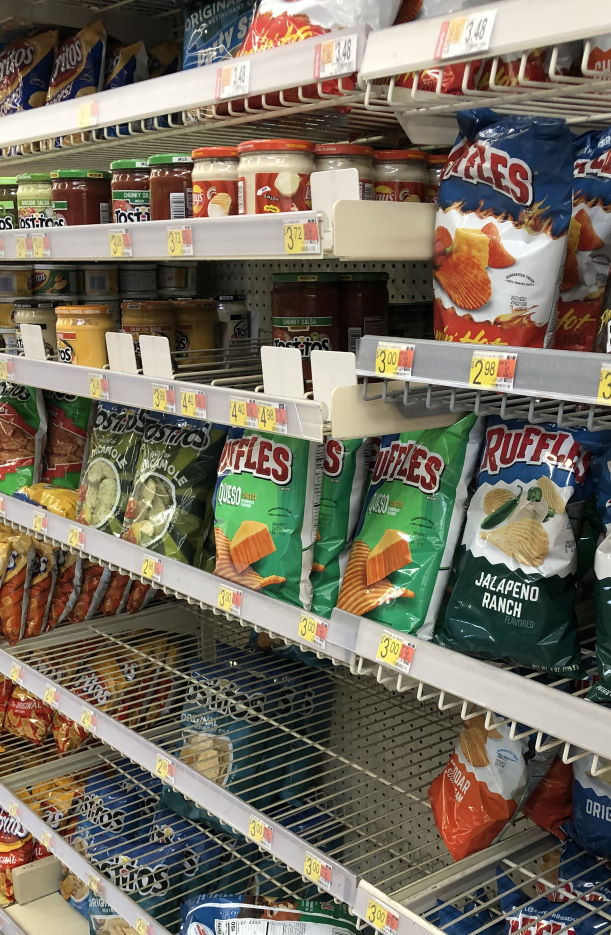
At what (x,y) coordinates should I click in order to perform the action: click on shelf sections. Please return your answer as a coordinate pair (x, y). The height and width of the screenshot is (935, 611). Looking at the image, I should click on (181, 94), (222, 242), (222, 396), (459, 364), (252, 609), (481, 679), (194, 787), (423, 926), (63, 855).